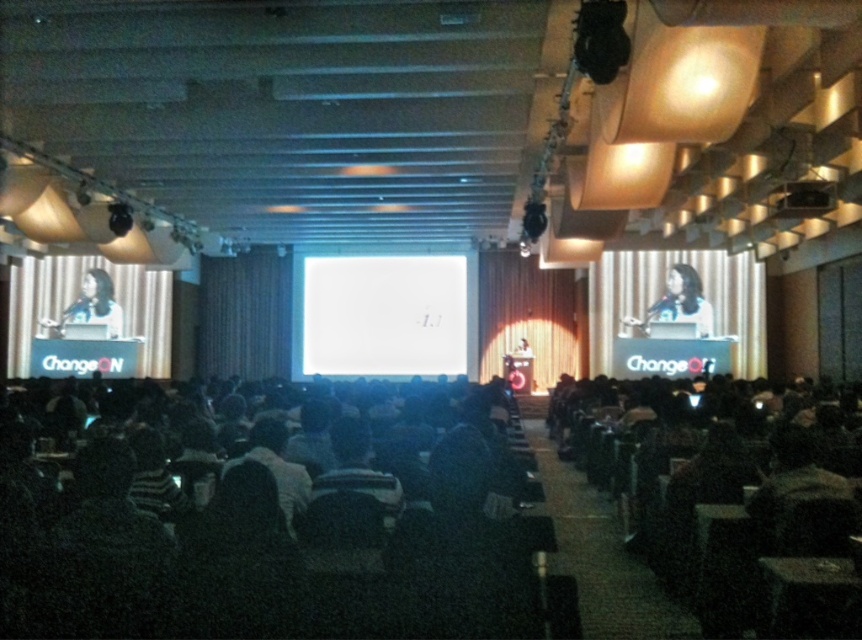
Question: Which is farther from the matte black laptop at right?

Choices:
 (A) black plastic projector at upper right
 (B) white matte projection screen at center
 (C) matte black laptop at left

Answer: (C)

Question: Can you confirm if matte black laptop at left is smaller than black plastic projector at upper right?

Choices:
 (A) no
 (B) yes

Answer: (A)

Question: Observing the image, what is the correct spatial positioning of white matte projection screen at center in reference to black plastic projector at upper right?

Choices:
 (A) left
 (B) right

Answer: (A)

Question: Among these objects, which one is farthest from the camera?

Choices:
 (A) matte black laptop at left
 (B) matte black laptop at right
 (C) black plastic projector at upper right

Answer: (A)

Question: Does white matte projection screen at center appear over matte black laptop at right?

Choices:
 (A) no
 (B) yes

Answer: (A)

Question: Which of the following is the closest to the observer?

Choices:
 (A) white matte projection screen at center
 (B) matte black laptop at right
 (C) black plastic projector at upper right
 (D) matte black laptop at left

Answer: (C)